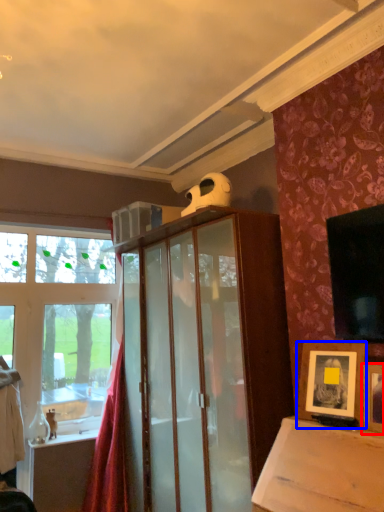
Question: Among these objects, which one is farthest to the camera, picture frame (highlighted by a red box) or picture frame (highlighted by a blue box)?

Choices:
 (A) picture frame
 (B) picture frame

Answer: (B)